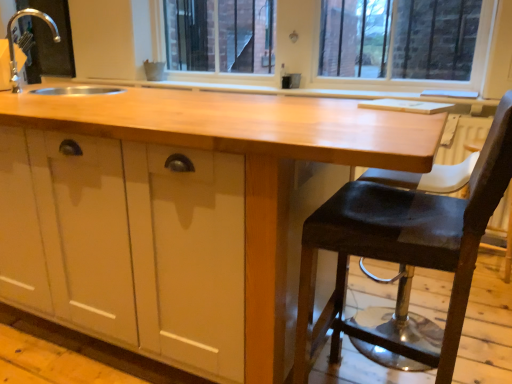
Question: Is glossy wood countertop at center facing away from silver metallic faucet at upper left?

Choices:
 (A) yes
 (B) no

Answer: (B)

Question: From a real-world perspective, is glossy wood countertop at center under silver metallic faucet at upper left?

Choices:
 (A) yes
 (B) no

Answer: (A)

Question: From a real-world perspective, is glossy wood countertop at center positioned over silver metallic faucet at upper left based on gravity?

Choices:
 (A) yes
 (B) no

Answer: (B)

Question: Is glossy wood countertop at center directly adjacent to silver metallic faucet at upper left?

Choices:
 (A) no
 (B) yes

Answer: (A)

Question: Is glossy wood countertop at center to the left of silver metallic faucet at upper left from the viewer's perspective?

Choices:
 (A) no
 (B) yes

Answer: (A)

Question: Is glossy wood countertop at center to the right of silver metallic faucet at upper left from the viewer's perspective?

Choices:
 (A) yes
 (B) no

Answer: (A)

Question: From the image's perspective, does dark brown leather stool at right appear lower than glossy wood countertop at center?

Choices:
 (A) no
 (B) yes

Answer: (B)

Question: Can you confirm if dark brown leather stool at right is wider than glossy wood countertop at center?

Choices:
 (A) yes
 (B) no

Answer: (B)

Question: Considering the relative sizes of dark brown leather stool at right and glossy wood countertop at center in the image provided, is dark brown leather stool at right shorter than glossy wood countertop at center?

Choices:
 (A) yes
 (B) no

Answer: (B)

Question: Is dark brown leather stool at right positioned in front of glossy wood countertop at center?

Choices:
 (A) no
 (B) yes

Answer: (B)

Question: Does dark brown leather stool at right turn towards glossy wood countertop at center?

Choices:
 (A) no
 (B) yes

Answer: (B)

Question: Is the depth of dark brown leather stool at right greater than that of glossy wood countertop at center?

Choices:
 (A) no
 (B) yes

Answer: (A)

Question: From a real-world perspective, does silver metallic faucet at upper left sit lower than glossy wood countertop at center?

Choices:
 (A) yes
 (B) no

Answer: (B)